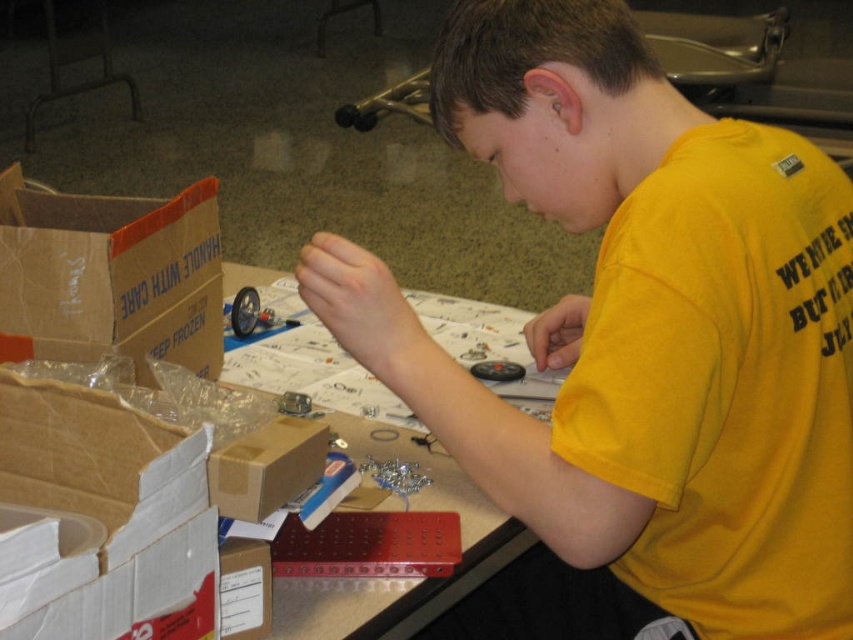
Question: Is brown cardboard box at left below white paper at center?

Choices:
 (A) no
 (B) yes

Answer: (A)

Question: Which object is farther from the camera taking this photo?

Choices:
 (A) yellow matte shirt at center
 (B) metallic blue wheel at center
 (C) brown cardboard box at left

Answer: (B)

Question: Does yellow matte shirt at center have a smaller size compared to metallic blue wheel at center?

Choices:
 (A) yes
 (B) no

Answer: (B)

Question: Which point is closer to the camera?

Choices:
 (A) (397, 618)
 (B) (842, 524)
 (C) (206, 308)
 (D) (260, 307)

Answer: (A)

Question: In this image, where is yellow matte shirt at center located relative to brown cardboard box at left?

Choices:
 (A) below
 (B) above

Answer: (A)

Question: Which object is the closest to the white paper at center?

Choices:
 (A) metallic blue wheel at center
 (B) yellow matte shirt at center

Answer: (A)